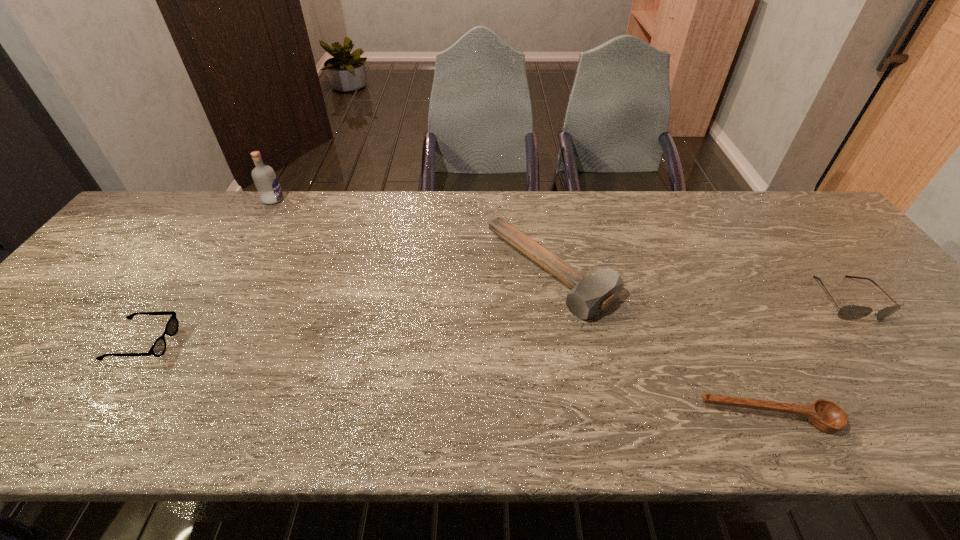
Image resolution: width=960 pixels, height=540 pixels. I want to click on free space between the third object from left to right and the vodka, so click(x=412, y=235).

At what (x,y) coordinates should I click in order to perform the action: click on free space between the tallest object and the wooden spoon. Please return your answer as a coordinate pair (x, y). The height and width of the screenshot is (540, 960). Looking at the image, I should click on (521, 309).

Image resolution: width=960 pixels, height=540 pixels. In order to click on empty space that is in between the tallest object and the third object from left to right in this screenshot , I will do `click(412, 235)`.

Point out which object is positioned as the second nearest to the spectacles. Please provide its 2D coordinates. Your answer should be formatted as a tuple, i.e. [(x, y)], where the tuple contains the x and y coordinates of a point satisfying the conditions above.

[(591, 294)]

What are the coordinates of `object that is the second closest to the sunglasses` in the screenshot? It's located at (591, 294).

In order to click on vacant space that satisfies the following two spatial constraints: 1. on the arms of the nearest object; 2. on the right side of the leftmost object in this screenshot , I will do `click(93, 418)`.

This screenshot has height=540, width=960. Identify the location of vacant space that satisfies the following two spatial constraints: 1. on the arms of the spectacles; 2. on the back side of the nearest object. (93, 418).

At what (x,y) coordinates should I click in order to perform the action: click on vacant space that satisfies the following two spatial constraints: 1. on the label of the tallest object; 2. on the back side of the fourth shortest object. Please return your answer as a coordinate pair (x, y). The width and height of the screenshot is (960, 540). Looking at the image, I should click on (232, 271).

Locate an element on the screen. This screenshot has width=960, height=540. free space that satisfies the following two spatial constraints: 1. on the back side of the second object from right to left; 2. on the arms of the spectacles is located at coordinates (732, 342).

This screenshot has height=540, width=960. I want to click on vacant area that satisfies the following two spatial constraints: 1. on the front side of the second tallest object; 2. on the arms of the spectacles, so click(563, 342).